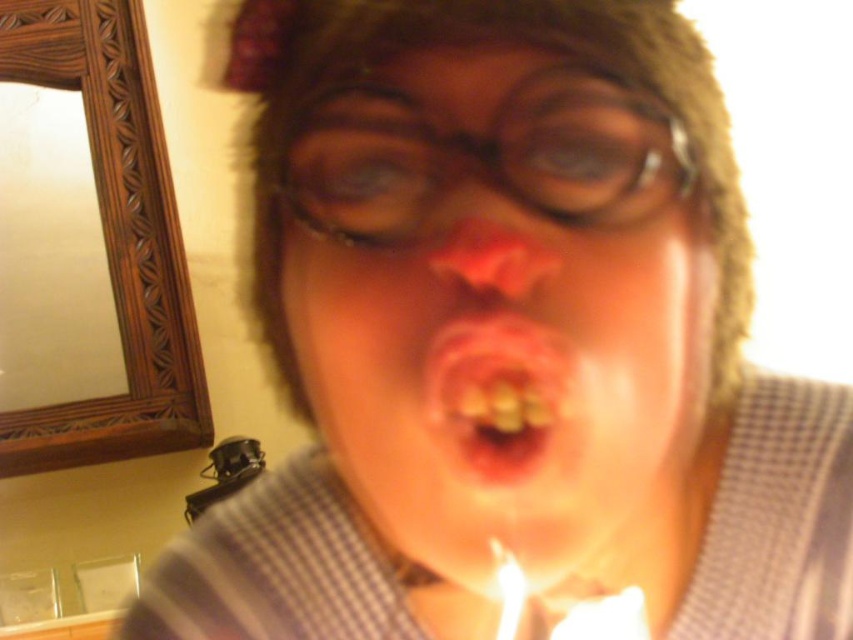
You are holding a camera and want to take a photo of the person blowing out the candle. The camera is currently at a position that is 27.24 centimeters away from the point at coordinates point (x=689, y=280). Is this distance sufficient to capture the entire scene of the person and the candle in the photo?

The point at coordinates point (x=689, y=280) and the camera are 27.24 centimeters apart. Since the camera is positioned at this distance, it should be sufficient to capture the entire scene of the person and the candle in the photo.

You are a photographer trying to capture the exact position of the black plastic glasses at center. What are the coordinates where you should focus your camera lens?

The black plastic glasses at center are located at coordinates point (482, 150).

In the scene shown: You are a photographer trying to capture the reflection of the black plastic glasses at center and the white wax candle at lower center in the mirror. Which object will appear larger in the mirror?

The black plastic glasses at center is closer to the viewer than the white wax candle at lower center, so it will appear larger in the mirror.